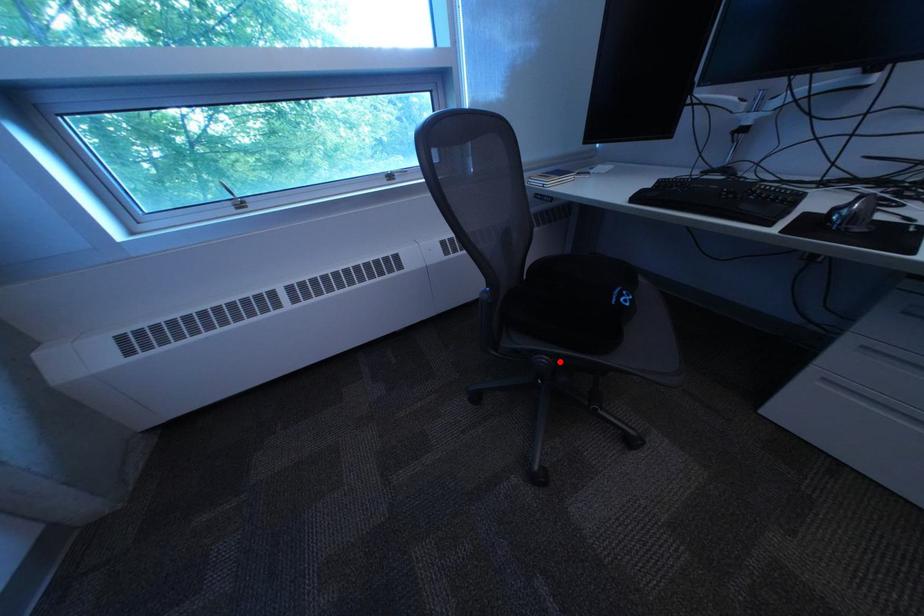
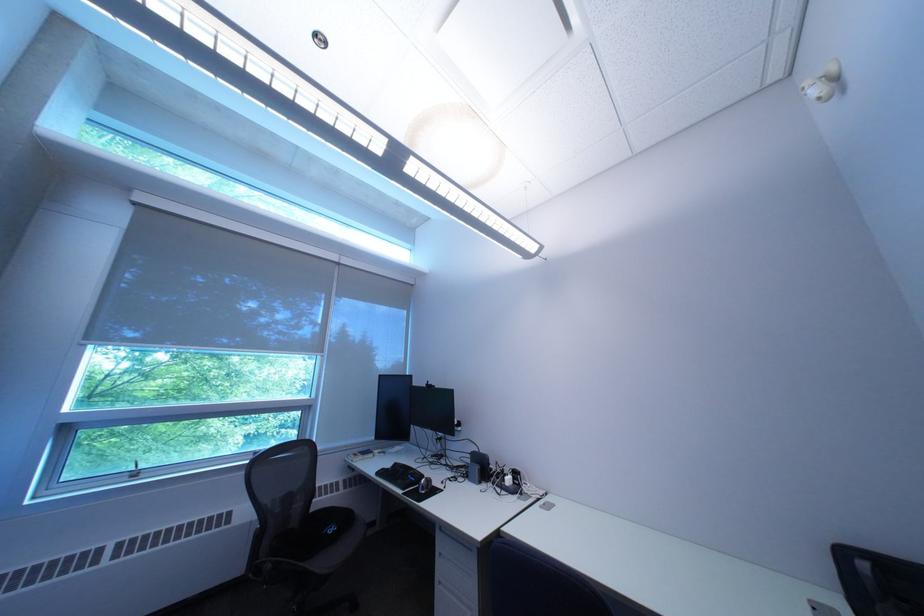
Question: I am providing you with two images of the same scene from different viewpoints. A red point is marked on the first image. Is the red point's position out of view in image 2?

Choices:
 (A) Yes
 (B) No

Answer: (B)